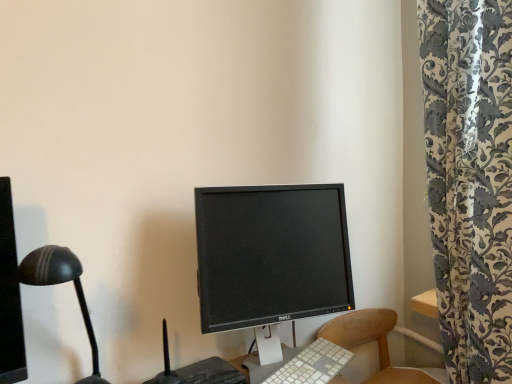
Find the location of a particular element. black matte desk lamp at left is located at coordinates (61, 283).

I want to click on white plastic keyboard at center, so click(312, 365).

Image resolution: width=512 pixels, height=384 pixels. Describe the element at coordinates (312, 365) in the screenshot. I see `white plastic keyboard at center` at that location.

The image size is (512, 384). What are the coordinates of `black matte desk lamp at left` in the screenshot? It's located at (61, 283).

What's the angular difference between black glossy monitor at center and black matte desk lamp at left's facing directions?

The angular difference between black glossy monitor at center and black matte desk lamp at left is 12 degrees.

Is black glossy monitor at center with black matte desk lamp at left?

There is a gap between black glossy monitor at center and black matte desk lamp at left.

Is black glossy monitor at center positioned with its back to black matte desk lamp at left?

No.

Which of these two, black glossy monitor at center or black matte desk lamp at left, stands taller?

black glossy monitor at center.

In terms of size, does white plastic keyboard at center appear bigger or smaller than wooden chair at lower right?

In the image, white plastic keyboard at center appears to be smaller than wooden chair at lower right.

Measure the distance between white plastic keyboard at center and wooden chair at lower right.

white plastic keyboard at center is 12.04 inches away from wooden chair at lower right.

From a real-world perspective, which is physically above, white plastic keyboard at center or wooden chair at lower right?

white plastic keyboard at center.

How distant is wooden chair at lower right from black matte desk lamp at left?

wooden chair at lower right is 3.63 feet away from black matte desk lamp at left.

Which object is thinner, wooden chair at lower right or black matte desk lamp at left?

With smaller width is black matte desk lamp at left.

From a real-world perspective, is wooden chair at lower right beneath black matte desk lamp at left?

Yes, from a real-world perspective, wooden chair at lower right is under black matte desk lamp at left.

Are white plastic keyboard at center and black matte desk lamp at left located far from each other?

No.

Does white plastic keyboard at center have a greater width compared to black matte desk lamp at left?

In fact, white plastic keyboard at center might be narrower than black matte desk lamp at left.

In the scene shown: From their relative heights in the image, would you say white plastic keyboard at center is taller or shorter than black matte desk lamp at left?

In the image, white plastic keyboard at center appears to be shorter than black matte desk lamp at left.

I want to click on computer monitor above the black matte desk lamp at left (from the image's perspective), so click(x=271, y=254).

Based on the photo, from the image's perspective, which one is positioned higher, black matte desk lamp at left or black glossy monitor at center?

From the image's view, black glossy monitor at center is above.

How different are the orientations of black matte desk lamp at left and black glossy monitor at center in degrees?

The angular difference between black matte desk lamp at left and black glossy monitor at center is 12 degrees.

In the image, is black matte desk lamp at left on the left side or the right side of black glossy monitor at center?

Based on their positions, black matte desk lamp at left is located to the left of black glossy monitor at center.

Between black glossy monitor at center and wooden chair at lower right, which one has more height?

black glossy monitor at center is taller.

Does black glossy monitor at center have a larger size compared to wooden chair at lower right?

Incorrect, black glossy monitor at center is not larger than wooden chair at lower right.

How many degrees apart are the facing directions of black glossy monitor at center and wooden chair at lower right?

black glossy monitor at center and wooden chair at lower right are facing 3.57 degrees away from each other.

Where is `computer monitor above the wooden chair at lower right (from a real-world perspective)`? The image size is (512, 384). computer monitor above the wooden chair at lower right (from a real-world perspective) is located at coordinates (271, 254).

Are black matte desk lamp at left and wooden chair at lower right beside each other?

No.

From the image's perspective, is black matte desk lamp at left below wooden chair at lower right?

Incorrect, from the image's perspective, black matte desk lamp at left is higher than wooden chair at lower right.

Where is `lamp above the wooden chair at lower right (from a real-world perspective)`? Image resolution: width=512 pixels, height=384 pixels. lamp above the wooden chair at lower right (from a real-world perspective) is located at coordinates (61, 283).

You are a GUI agent. You are given a task and a screenshot of the screen. Output one action in this format:
    pyautogui.click(x=<x>, y=<y>)
    Task: Click on the lamp on the left of black glossy monitor at center
    This screenshot has width=512, height=384.
    Given the screenshot: What is the action you would take?
    pyautogui.click(x=61, y=283)

This screenshot has width=512, height=384. Find the location of `chair lying below the white plastic keyboard at center (from the image's perspective)`. chair lying below the white plastic keyboard at center (from the image's perspective) is located at coordinates (377, 342).

Looking at the image, which one is located further to white plastic keyboard at center, wooden chair at lower right or black matte desk lamp at left?

black matte desk lamp at left.

From the image, which object appears to be farther from black glossy monitor at center, wooden chair at lower right or black matte desk lamp at left?

Among the two, black matte desk lamp at left is located further to black glossy monitor at center.

Looking at this image, based on their spatial positions, is black matte desk lamp at left or black glossy monitor at center closer to white plastic keyboard at center?

black glossy monitor at center lies closer to white plastic keyboard at center than the other object.

Considering their positions, is white plastic keyboard at center positioned further to black glossy monitor at center than wooden chair at lower right?

The object further to black glossy monitor at center is wooden chair at lower right.

From the image, which object appears to be farther from black glossy monitor at center, black matte desk lamp at left or wooden chair at lower right?

Based on the image, black matte desk lamp at left appears to be further to black glossy monitor at center.

Which object lies further to the anchor point white plastic keyboard at center, black matte desk lamp at left or wooden chair at lower right?

Based on the image, black matte desk lamp at left appears to be further to white plastic keyboard at center.

Considering their positions, is black glossy monitor at center positioned further to white plastic keyboard at center than black matte desk lamp at left?

black matte desk lamp at left is further to white plastic keyboard at center.

Based on their spatial positions, is wooden chair at lower right or black glossy monitor at center closer to white plastic keyboard at center?

Among the two, black glossy monitor at center is located nearer to white plastic keyboard at center.

Image resolution: width=512 pixels, height=384 pixels. Find the location of `computer monitor situated between black matte desk lamp at left and white plastic keyboard at center from left to right`. computer monitor situated between black matte desk lamp at left and white plastic keyboard at center from left to right is located at coordinates (271, 254).

The width and height of the screenshot is (512, 384). I want to click on computer keyboard between black glossy monitor at center and wooden chair at lower right in the horizontal direction, so click(312, 365).

Where is `computer keyboard located between black matte desk lamp at left and wooden chair at lower right in the left-right direction`? computer keyboard located between black matte desk lamp at left and wooden chair at lower right in the left-right direction is located at coordinates 312,365.

I want to click on computer monitor between black matte desk lamp at left and wooden chair at lower right, so click(x=271, y=254).